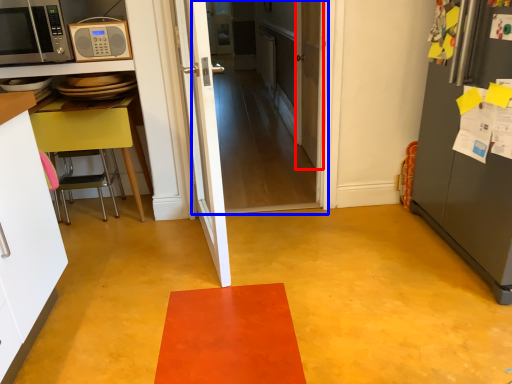
Question: Among these objects, which one is nearest to the camera, door (highlighted by a red box) or door (highlighted by a blue box)?

Choices:
 (A) door
 (B) door

Answer: (B)